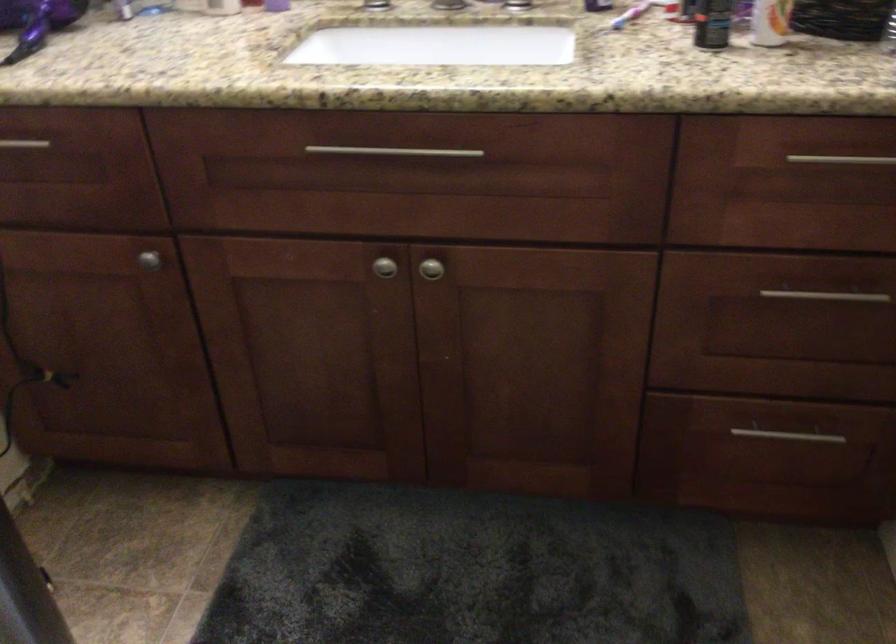
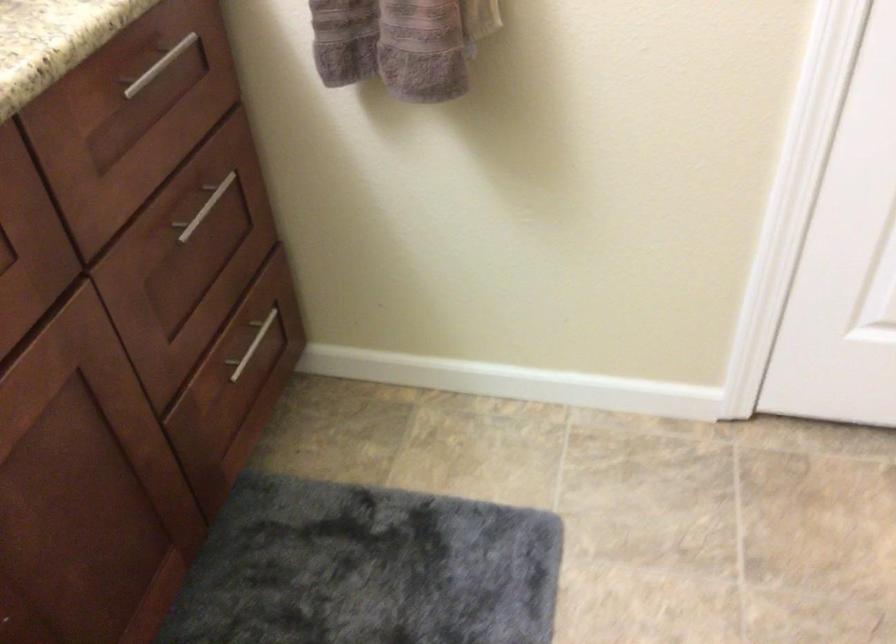
The images are taken continuously from a first-person perspective. In which direction is your viewpoint rotating?

The camera rotated toward right-down.